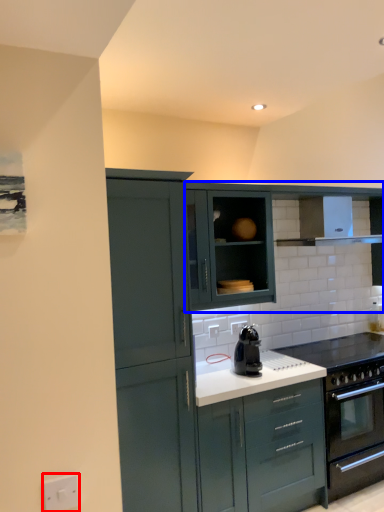
Question: Among these objects, which one is nearest to the camera, electric outlet (highlighted by a red box) or cabinetry (highlighted by a blue box)?

Choices:
 (A) electric outlet
 (B) cabinetry

Answer: (A)